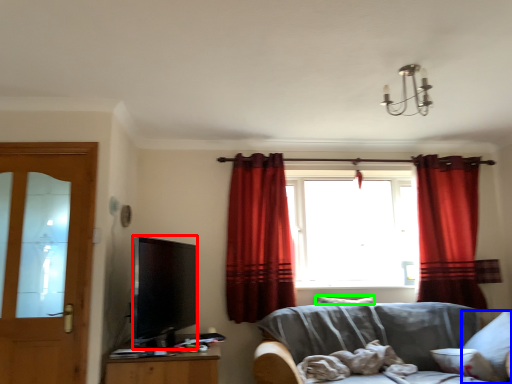
Question: Based on their relative distances, which object is farther from television (highlighted by a red box)? Choose from pillow (highlighted by a blue box) and pillow (highlighted by a green box).

Choices:
 (A) pillow
 (B) pillow

Answer: (A)